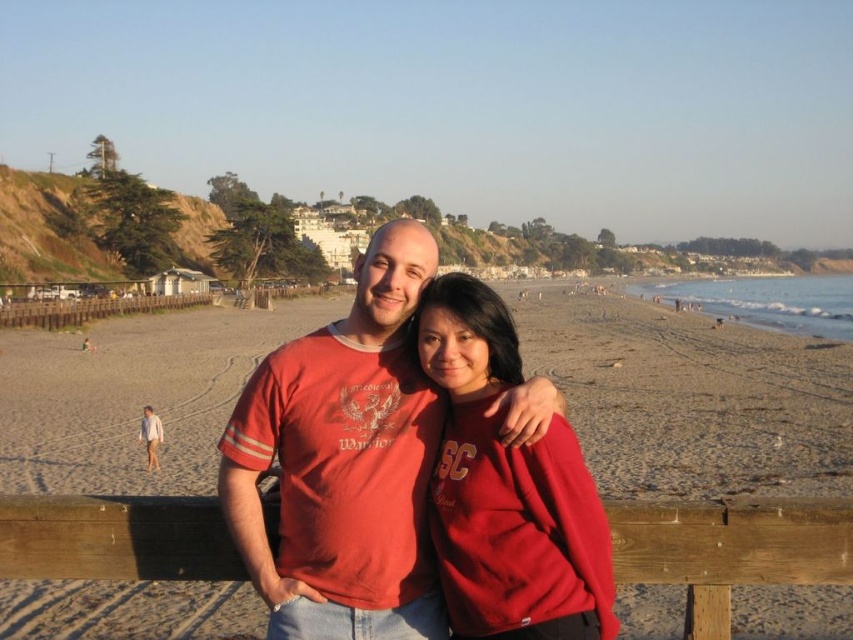
From the picture: You are standing at the center of the beach scene. There is a matte red shirt at center. Where exactly is the matte red shirt located in terms of coordinates?

The matte red shirt at center is located at point coordinates (698, 388).

You are a photographer setting up a tripod to capture the sunset at the beach. You notice the matte red sweatshirt at center and the wooden at lower center. Which object should you focus on to ensure it appears larger in your photo?

The wooden at lower center should be focused on because it is positioned above the matte red sweatshirt at center, making it appear larger in the photo due to its higher placement.

You are a photographer trying to capture the wooden at lower center and the matte red sweatshirt at center in the same frame. Based on their positions, which object should you focus on first to ensure both are in the shot?

The wooden at lower center is behind the matte red sweatshirt at center, so you should focus on the matte red sweatshirt at center first to ensure both are in the shot.